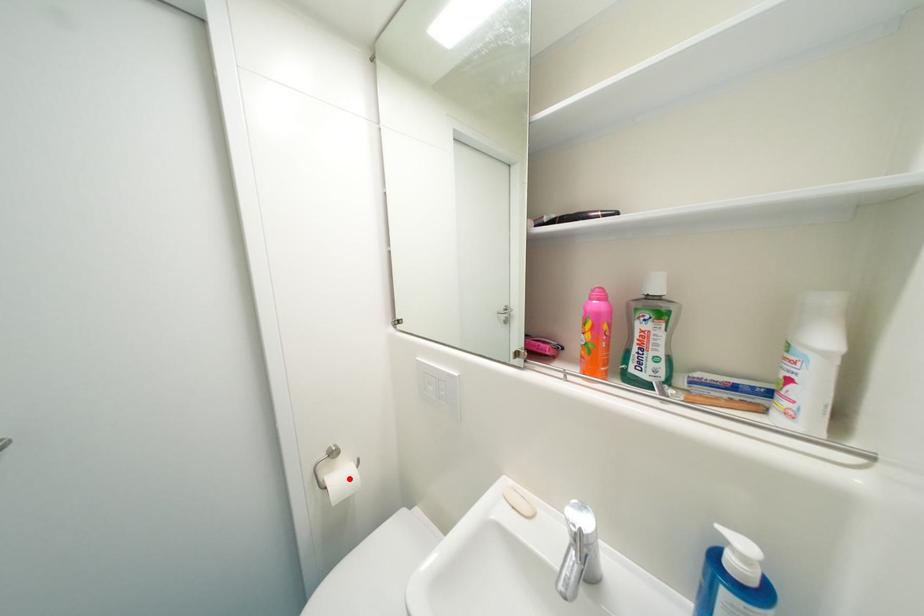
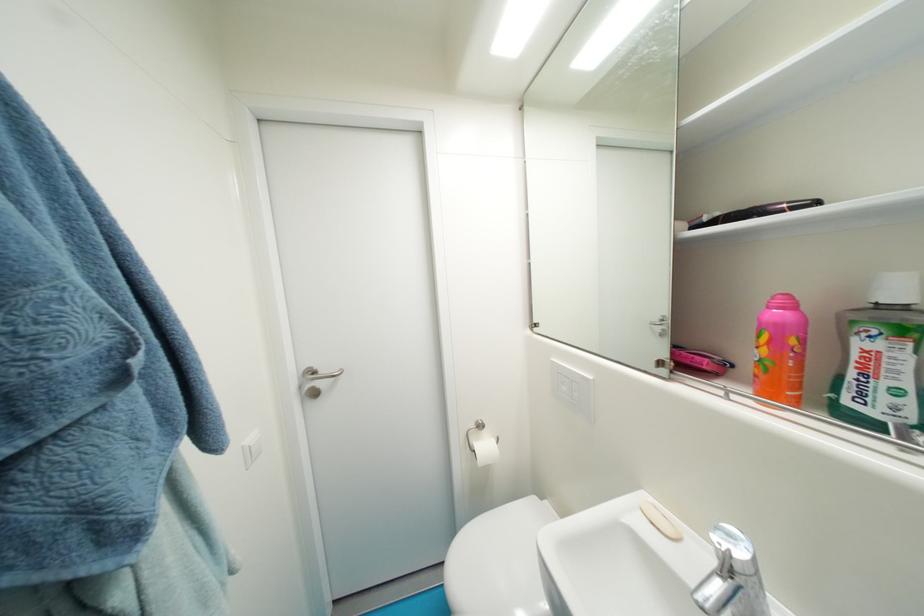
The point at the highlighted location is marked in the first image. Where is the corresponding point in the second image?

(492, 448)